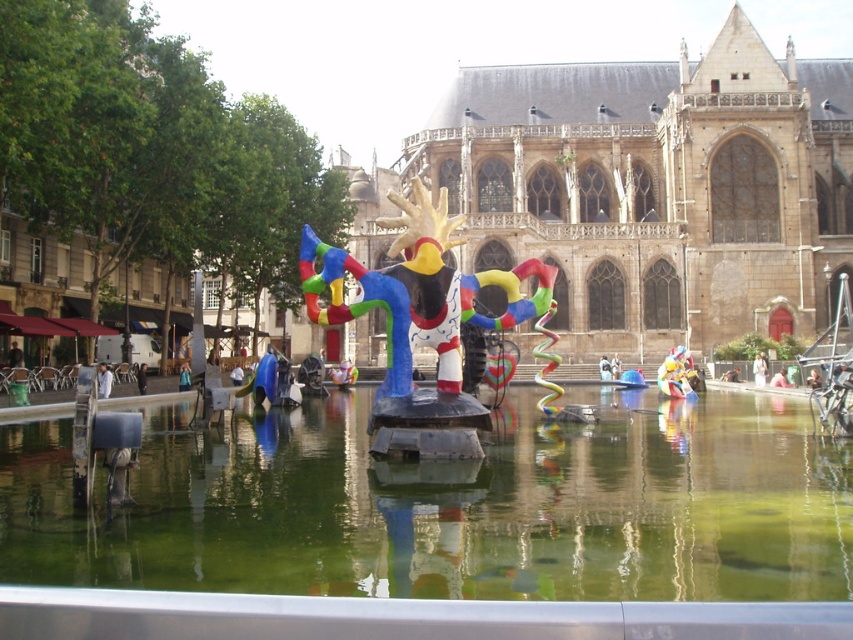
Which is in front, point (401, 218) or point (677, 396)?

Positioned in front is point (401, 218).

Which is behind, point (540, 305) or point (672, 394)?

The point (672, 394) is more distant.

Locate an element on the screen. multicolored plastic sculpture at center is located at coordinates click(421, 323).

Locate an element on the screen. This screenshot has width=853, height=640. green reflective water at center is located at coordinates (451, 506).

Can you confirm if green reflective water at center is smaller than multicolored plastic sculpture at center?

Yes.

Where is `green reflective water at center`? The height and width of the screenshot is (640, 853). green reflective water at center is located at coordinates (451, 506).

Who is lower down, green reflective water at center or brown stone cathedral at center?

green reflective water at center

Can you confirm if green reflective water at center is bigger than brown stone cathedral at center?

Incorrect, green reflective water at center is not larger than brown stone cathedral at center.

The height and width of the screenshot is (640, 853). Find the location of `green reflective water at center`. green reflective water at center is located at coordinates (451, 506).

At what (x,y) coordinates should I click in order to perform the action: click on green reflective water at center. Please return your answer as a coordinate pair (x, y). Looking at the image, I should click on (451, 506).